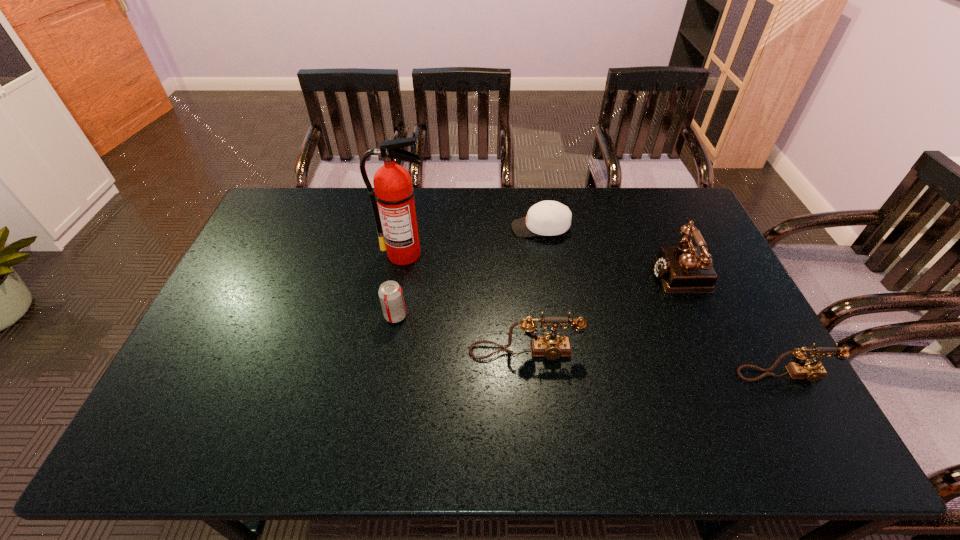
This screenshot has width=960, height=540. What are the coordinates of `free space located on the front-facing side of the baseball cap` in the screenshot? It's located at (411, 228).

The image size is (960, 540). I want to click on vacant space located 0.330m on the front-facing side of the baseball cap, so click(417, 228).

The width and height of the screenshot is (960, 540). I want to click on vacant space positioned 0.140m on the front-facing side of the baseball cap, so click(x=471, y=228).

Find the location of a particular element. This screenshot has height=540, width=960. free space located 0.190m on the dial of the farthest telephone is located at coordinates (591, 273).

Where is `blank space located 0.180m on the dial of the farthest telephone`? The width and height of the screenshot is (960, 540). blank space located 0.180m on the dial of the farthest telephone is located at coordinates (594, 273).

The image size is (960, 540). I want to click on free space located on the dial of the farthest telephone, so click(x=626, y=273).

Locate an element on the screen. vacant point located on the back of the soda can is located at coordinates coord(405,258).

Find the location of a particular element. vacant space located 0.100m on the side of the fire extinguisher near the handle is located at coordinates (398, 289).

The height and width of the screenshot is (540, 960). Find the location of `object that is at the far edge`. object that is at the far edge is located at coordinates pyautogui.click(x=548, y=218).

This screenshot has width=960, height=540. I want to click on object that is at the near edge, so coord(802,368).